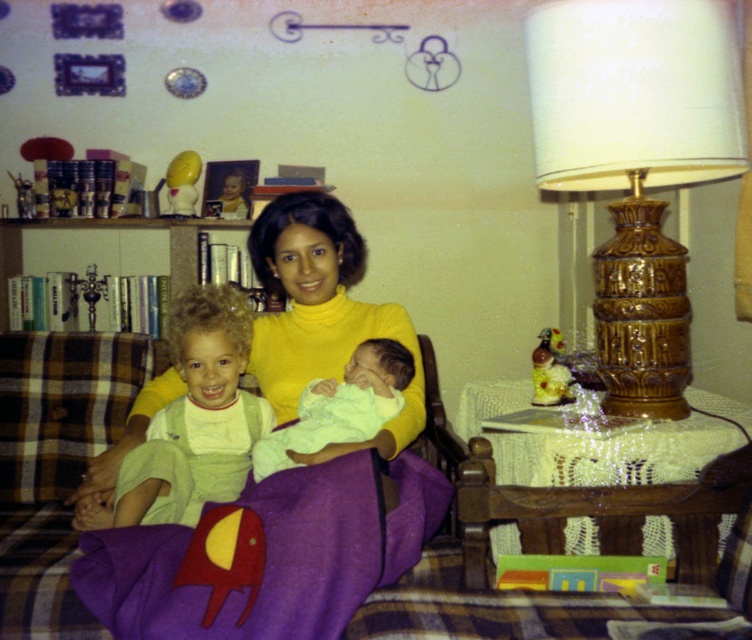
You are an interior designer planning to place a new rectangular side table between the gold textured lamp at right and the purple fleece blanket at lower left. The side table is 1.2 meters wide. Can the side table fit between them based on their widths?

The gold textured lamp at right is narrower than the purple fleece blanket at lower left, but the exact widths aren not provided. However, since the side table requires 1.2 meters of space and we only know the comparative width between the two objects, it is impossible to determine if there is enough space without specific measurements.

In the scene shown: You are a photographer trying to capture a closeup shot of the purple fleece blanket at lower left and the light green fabric baby at center. Given that your camera has a maximum focus range of 8 inches, will you be able to focus on both subjects simultaneously?

The distance between the purple fleece blanket at lower left and the light green fabric baby at center is 8.26 inches. Since this exceeds the camera maximum focus range of 8 inches, you cannot focus on both subjects simultaneously.